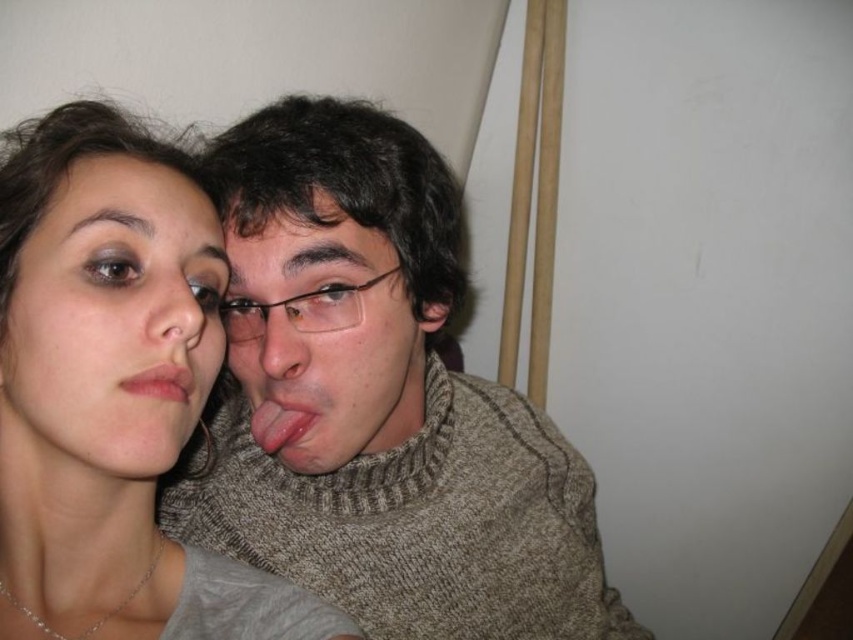
Who is taller, pink glossy tongue at center or pink matte lips at center?

With more height is pink glossy tongue at center.

Is point (260, 422) positioned in front of point (146, 381)?

No, it is not.

You are a GUI agent. You are given a task and a screenshot of the screen. Output one action in this format:
    pyautogui.click(x=<x>, y=<y>)
    Task: Click on the pink glossy tongue at center
    Image resolution: width=853 pixels, height=640 pixels.
    Given the screenshot: What is the action you would take?
    pyautogui.click(x=281, y=422)

Who is taller, matte skin face at left or pink glossy tongue at center?

matte skin face at left is taller.

In order to click on matte skin face at left in this screenshot , I will do [x=112, y=316].

You are a GUI agent. You are given a task and a screenshot of the screen. Output one action in this format:
    pyautogui.click(x=<x>, y=<y>)
    Task: Click on the matte skin face at left
    The width and height of the screenshot is (853, 640).
    Given the screenshot: What is the action you would take?
    pyautogui.click(x=112, y=316)

Does matte gray shirt at upper left appear on the right side of pink glossy tongue at center?

Incorrect, matte gray shirt at upper left is not on the right side of pink glossy tongue at center.

Locate an element on the screen. Image resolution: width=853 pixels, height=640 pixels. matte gray shirt at upper left is located at coordinates (97, 369).

Who is more forward, (79, 465) or (274, 440)?

Point (79, 465) is more forward.

You are a GUI agent. You are given a task and a screenshot of the screen. Output one action in this format:
    pyautogui.click(x=<x>, y=<y>)
    Task: Click on the matte gray shirt at upper left
    The width and height of the screenshot is (853, 640).
    Given the screenshot: What is the action you would take?
    pyautogui.click(x=97, y=369)